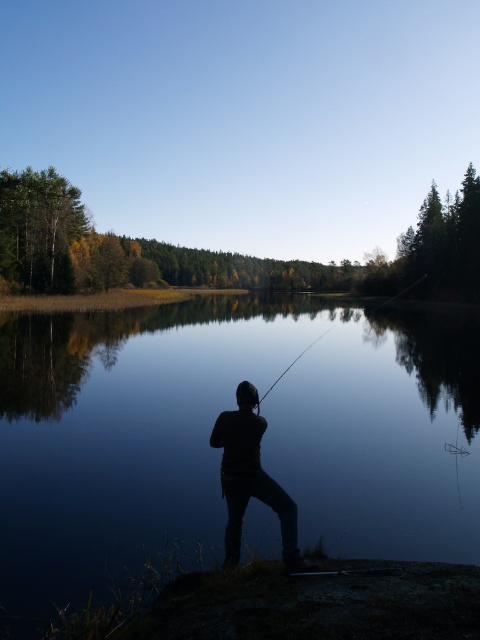
You are a photographer trying to capture the reflection of the smooth black rod at center in the water. Since the black matte person at center is blocking your view, can you move around them to get a clear shot of the rod?

The black matte person at center is in front of the smooth black rod at center, so moving around them might allow you to see the rod without obstruction. However, the rod is also black, which may blend into the person and make it harder to capture clearly.

You are standing at the lakeside and want to reach a specific point marked at coordinates point (244, 493). If you can walk 1.2 meters per second, how long will it take you to reach that point?

The distance of point (244, 493) from viewer is 5.62 meters. At a walking speed of 1.2 meters per second, it would take approximately 4.68 seconds to reach the point.